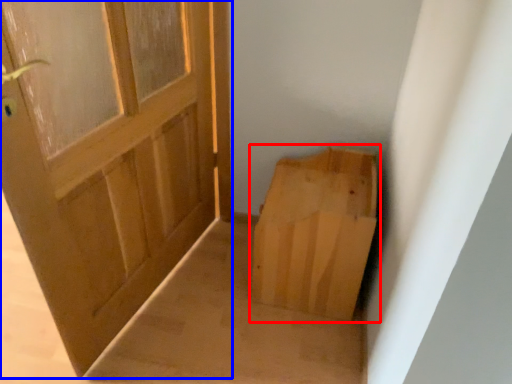
Question: Which of the following is the farthest to the observer, cardboard box (highlighted by a red box) or door (highlighted by a blue box)?

Choices:
 (A) cardboard box
 (B) door

Answer: (A)